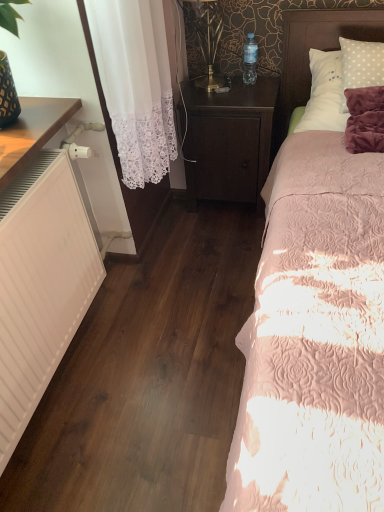
Question: Does transparent plastic bottle at upper center have a smaller size compared to white matte heater at left?

Choices:
 (A) yes
 (B) no

Answer: (A)

Question: Is transparent plastic bottle at upper center with white matte heater at left?

Choices:
 (A) yes
 (B) no

Answer: (B)

Question: Does transparent plastic bottle at upper center lie in front of white matte heater at left?

Choices:
 (A) yes
 (B) no

Answer: (B)

Question: Is transparent plastic bottle at upper center shorter than white matte heater at left?

Choices:
 (A) yes
 (B) no

Answer: (A)

Question: Can you confirm if transparent plastic bottle at upper center is positioned to the right of white matte heater at left?

Choices:
 (A) no
 (B) yes

Answer: (B)

Question: In terms of size, does pink quilted bed at right appear bigger or smaller than transparent plastic bottle at upper center?

Choices:
 (A) small
 (B) big

Answer: (B)

Question: Would you say pink quilted bed at right is inside or outside transparent plastic bottle at upper center?

Choices:
 (A) inside
 (B) outside

Answer: (B)

Question: Is pink quilted bed at right wider or thinner than transparent plastic bottle at upper center?

Choices:
 (A) thin
 (B) wide

Answer: (B)

Question: Is point (337, 184) positioned closer to the camera than point (251, 38)?

Choices:
 (A) farther
 (B) closer

Answer: (B)

Question: Considering the positions of white matte heater at left and dark wood nightstand at center in the image, is white matte heater at left bigger or smaller than dark wood nightstand at center?

Choices:
 (A) small
 (B) big

Answer: (B)

Question: Visually, is white matte heater at left positioned to the left or to the right of dark wood nightstand at center?

Choices:
 (A) left
 (B) right

Answer: (A)

Question: Is point (31, 351) positioned closer to the camera than point (244, 113)?

Choices:
 (A) closer
 (B) farther

Answer: (A)

Question: From a real-world perspective, is white matte heater at left physically located above or below dark wood nightstand at center?

Choices:
 (A) above
 (B) below

Answer: (A)

Question: Visually, is transparent plastic bottle at upper center positioned to the left or to the right of white polka dot pillow at upper right?

Choices:
 (A) right
 (B) left

Answer: (B)

Question: From a real-world perspective, is transparent plastic bottle at upper center positioned above or below white polka dot pillow at upper right?

Choices:
 (A) below
 (B) above

Answer: (B)